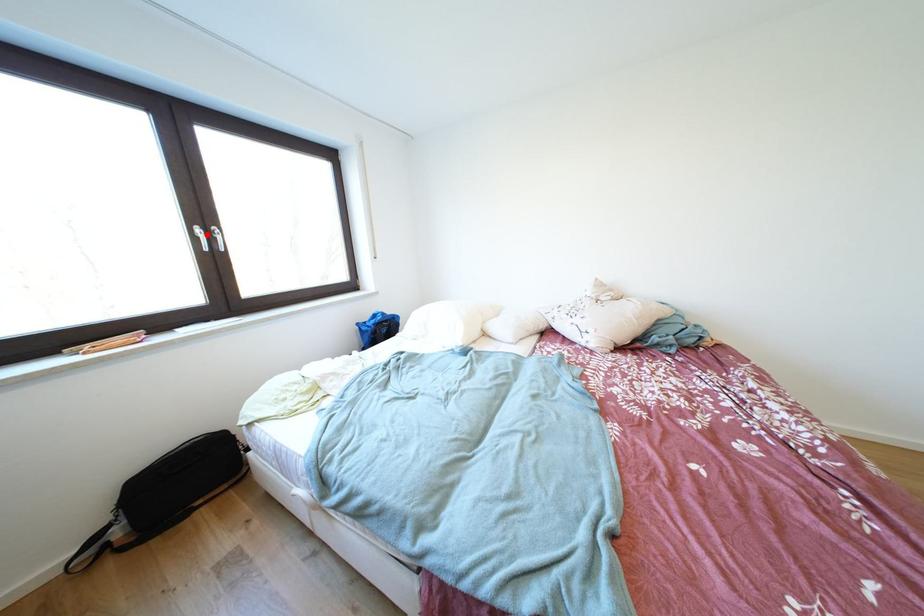
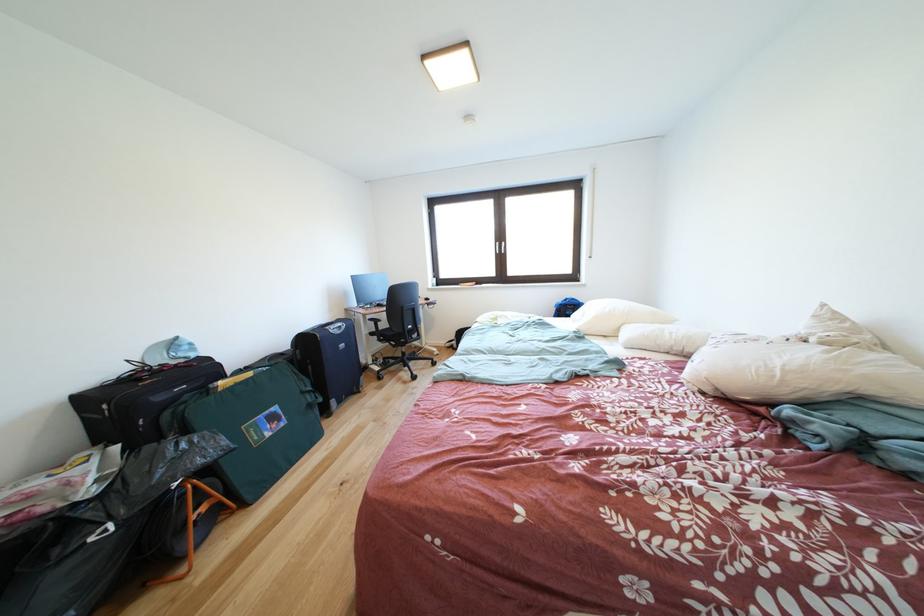
Question: I am providing you with two images of the same scene from different viewpoints. A red point is marked on the first image. At the location where the point appears in image 1, is it still visible in image 2?

Choices:
 (A) Yes
 (B) No

Answer: (A)